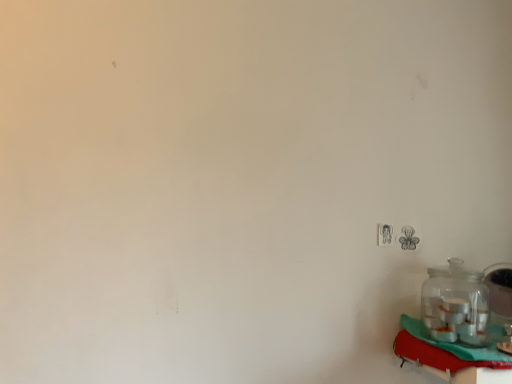
Question: Would you say red fabric table at lower right is to the left or to the right of clear glass jar at right in the picture?

Choices:
 (A) left
 (B) right

Answer: (B)

Question: Considering the positions of red fabric table at lower right and clear glass jar at right in the image, is red fabric table at lower right taller or shorter than clear glass jar at right?

Choices:
 (A) tall
 (B) short

Answer: (B)

Question: From the image's perspective, relative to clear glass jar at right, is red fabric table at lower right above or below?

Choices:
 (A) above
 (B) below

Answer: (B)

Question: Is clear glass jar at right wider or thinner than red fabric table at lower right?

Choices:
 (A) thin
 (B) wide

Answer: (A)

Question: In terms of height, does clear glass jar at right look taller or shorter compared to red fabric table at lower right?

Choices:
 (A) short
 (B) tall

Answer: (B)

Question: Would you say clear glass jar at right is inside or outside red fabric table at lower right?

Choices:
 (A) outside
 (B) inside

Answer: (A)

Question: Would you say clear glass jar at right is to the left or to the right of red fabric table at lower right in the picture?

Choices:
 (A) right
 (B) left

Answer: (B)